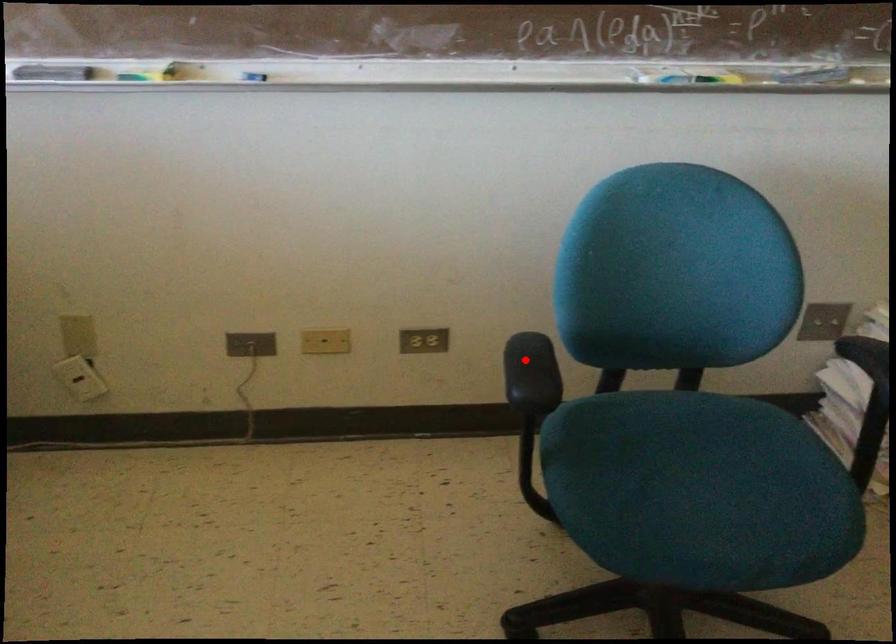
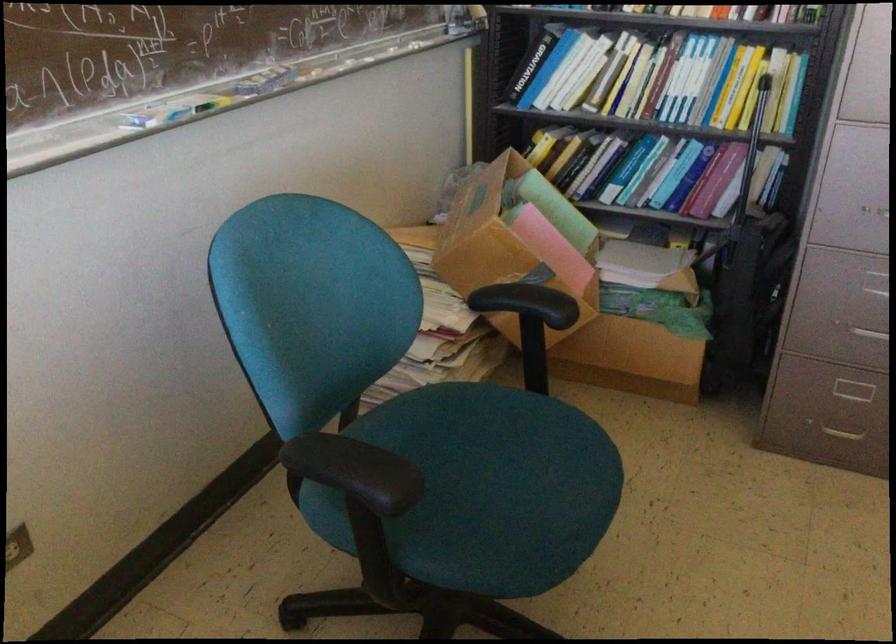
Locate, in the second image, the point that corresponds to the highlighted location in the first image.

(356, 471)